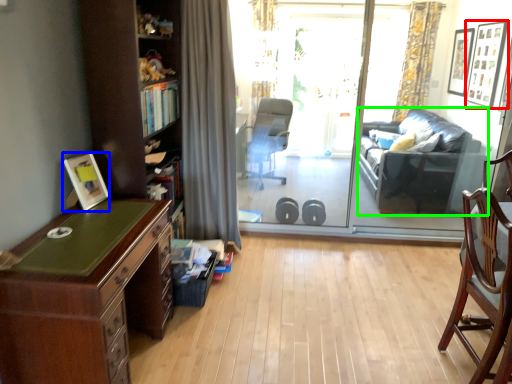
Question: Considering the real-world distances, which object is closest to picture frame (highlighted by a red box)? picture frame (highlighted by a blue box) or studio couch (highlighted by a green box).

Choices:
 (A) picture frame
 (B) studio couch

Answer: (B)